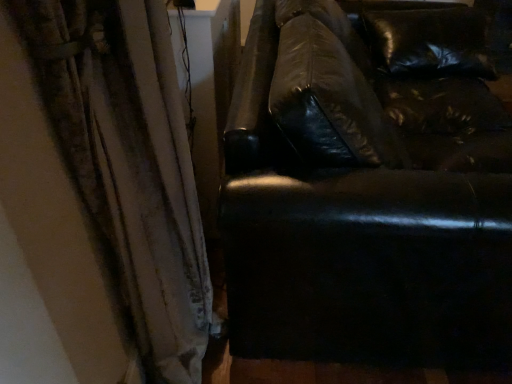
Question: Is white textured curtain at left positioned behind shiny black leather couch at right?

Choices:
 (A) yes
 (B) no

Answer: (B)

Question: From a real-world perspective, is white textured curtain at left on top of shiny black leather couch at right?

Choices:
 (A) yes
 (B) no

Answer: (A)

Question: Is white textured curtain at left thinner than shiny black leather couch at right?

Choices:
 (A) no
 (B) yes

Answer: (B)

Question: Are white textured curtain at left and shiny black leather couch at right beside each other?

Choices:
 (A) no
 (B) yes

Answer: (A)

Question: Is white textured curtain at left aimed at shiny black leather couch at right?

Choices:
 (A) yes
 (B) no

Answer: (A)

Question: Does white textured curtain at left have a lesser height compared to shiny black leather couch at right?

Choices:
 (A) no
 (B) yes

Answer: (A)

Question: Can you confirm if shiny black leather couch at right is positioned to the right of white textured curtain at left?

Choices:
 (A) yes
 (B) no

Answer: (A)

Question: Is shiny black leather couch at right bigger than white textured curtain at left?

Choices:
 (A) yes
 (B) no

Answer: (A)

Question: Does shiny black leather couch at right have a greater width compared to white textured curtain at left?

Choices:
 (A) yes
 (B) no

Answer: (A)

Question: Considering the relative positions of shiny black leather couch at right and white textured curtain at left in the image provided, is shiny black leather couch at right in front of white textured curtain at left?

Choices:
 (A) yes
 (B) no

Answer: (B)

Question: Considering the relative sizes of shiny black leather couch at right and white textured curtain at left in the image provided, is shiny black leather couch at right taller than white textured curtain at left?

Choices:
 (A) no
 (B) yes

Answer: (A)

Question: Considering the relative sizes of shiny black leather couch at right and white textured curtain at left in the image provided, is shiny black leather couch at right shorter than white textured curtain at left?

Choices:
 (A) yes
 (B) no

Answer: (A)

Question: From a real-world perspective, is shiny black leather couch at right physically located above or below white textured curtain at left?

Choices:
 (A) above
 (B) below

Answer: (B)